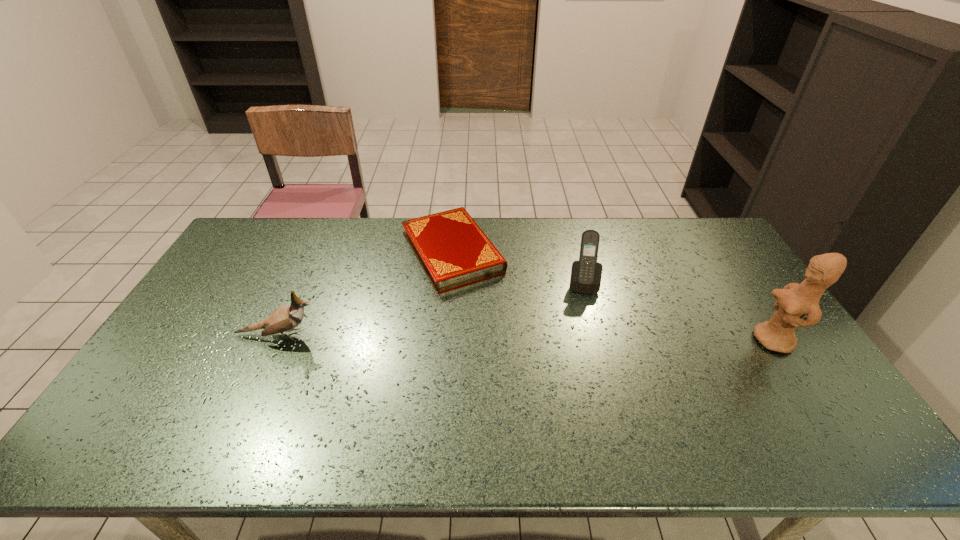
Find the location of `free space located 0.300m on the cover of the hardback book`. free space located 0.300m on the cover of the hardback book is located at coordinates (518, 357).

What are the coordinates of `free space located 0.220m on the cover of the hardback book` in the screenshot? It's located at (505, 337).

Where is `vacant area situated 0.270m on the cover of the hardback book`? vacant area situated 0.270m on the cover of the hardback book is located at coordinates (514, 349).

You are a GUI agent. You are given a task and a screenshot of the screen. Output one action in this format:
    pyautogui.click(x=<x>, y=<y>)
    Task: Click on the vacant area situated 0.390m on the front-facing side of the cellular telephone
    This screenshot has height=540, width=960.
    Given the screenshot: What is the action you would take?
    pyautogui.click(x=589, y=400)

At what (x,y) coordinates should I click in order to perform the action: click on vacant area situated 0.190m on the front-facing side of the cellular telephone. Please return your answer as a coordinate pair (x, y). The height and width of the screenshot is (540, 960). Looking at the image, I should click on (586, 340).

Identify the location of vacant space situated 0.100m on the front-facing side of the cellular telephone. The height and width of the screenshot is (540, 960). (585, 317).

At what (x,y) coordinates should I click in order to perform the action: click on object that is at the far edge. Please return your answer as a coordinate pair (x, y). Looking at the image, I should click on (453, 251).

Locate an element on the screen. The height and width of the screenshot is (540, 960). object positioned at the right edge is located at coordinates (795, 300).

Find the location of a particular element. The width and height of the screenshot is (960, 540). free spot at the far edge of the desktop is located at coordinates (624, 218).

In the image, there is a desktop. Find the location of `vacant area at the near edge`. vacant area at the near edge is located at coordinates (190, 416).